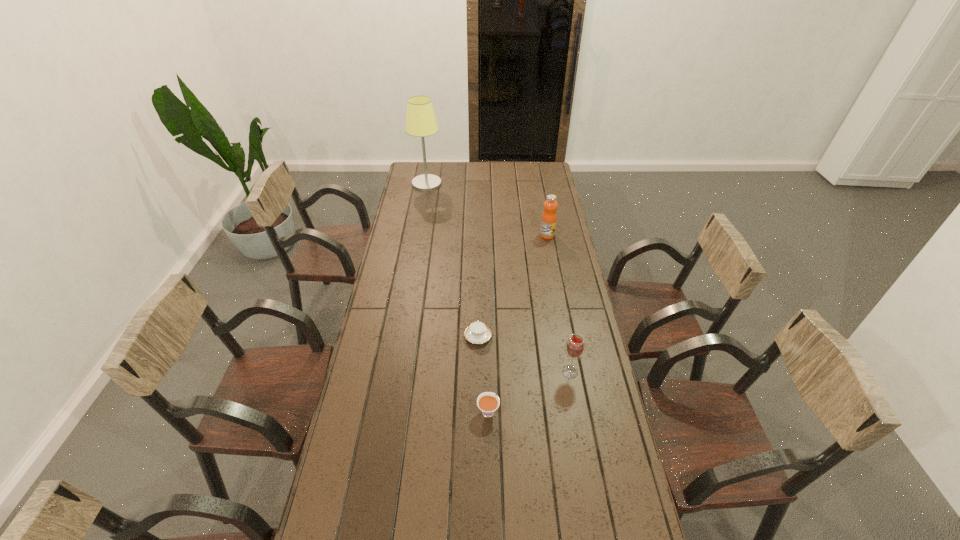
Find the location of a particular element. The image size is (960, 540). object located in the left edge section of the desktop is located at coordinates (421, 121).

Image resolution: width=960 pixels, height=540 pixels. Find the location of `fruit juice present at the right edge`. fruit juice present at the right edge is located at coordinates (548, 224).

The width and height of the screenshot is (960, 540). I want to click on wineglass that is at the right edge, so click(x=575, y=346).

Image resolution: width=960 pixels, height=540 pixels. In order to click on object located in the far left corner section of the desktop in this screenshot , I will do `click(421, 121)`.

Image resolution: width=960 pixels, height=540 pixels. In the image, there is a desktop. In order to click on free space at the far edge in this screenshot , I will do `click(497, 183)`.

In the image, there is a desktop. Where is `vacant space at the left edge`? This screenshot has height=540, width=960. vacant space at the left edge is located at coordinates (403, 328).

You are a GUI agent. You are given a task and a screenshot of the screen. Output one action in this format:
    pyautogui.click(x=<x>, y=<y>)
    Task: Click on the vacant space at the right edge of the desktop
    The height and width of the screenshot is (540, 960).
    Given the screenshot: What is the action you would take?
    pyautogui.click(x=573, y=276)

Image resolution: width=960 pixels, height=540 pixels. I want to click on free space between the third shortest object and the shorter teacup, so click(x=524, y=354).

Image resolution: width=960 pixels, height=540 pixels. I want to click on empty space between the fruit juice and the wineglass, so click(559, 303).

The height and width of the screenshot is (540, 960). I want to click on free point between the fourth farthest object and the nearer teacup, so click(x=529, y=392).